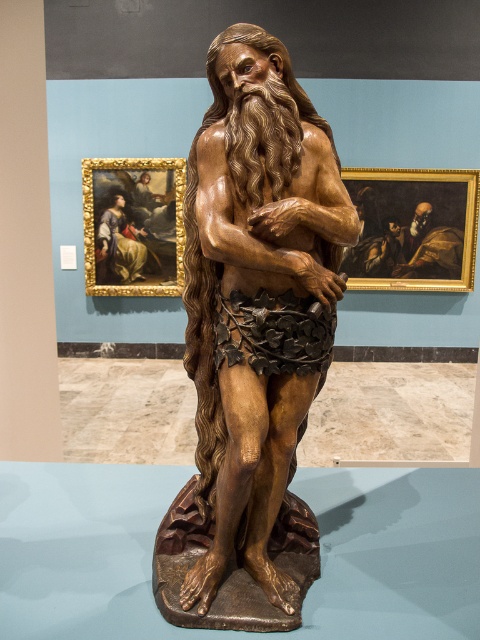
You are an art curator planning to install a new exhibition. You need to determine the placement of two paintings in the gallery. The dark brown wood painting at right and the oil painting at upper left are to be hung on a wall. Given their sizes, which painting should be placed higher to maintain visual balance?

The oil painting at upper left is taller than the dark brown wood painting at right. To maintain visual balance, the taller oil painting at upper left should be placed higher on the wall, while the shorter dark brown wood painting at right can be positioned lower.

You are an art curator planning to install a new spotlight at point (415,228). Is there an object at that location that might block the spotlight?

Yes, the dark brown wood painting at right is located at point (415,228), so it will block the spotlight.

You are an art curator planning to move the dark brown wood painting at right and the oil painting at upper left to a new exhibition space. If you want to maintain the same spatial relationship between them as in the current gallery, which painting should be placed closer to the entrance?

The dark brown wood painting at right should be placed closer to the entrance because it was originally in front of the oil painting at upper left, meaning it is closer to the viewer.